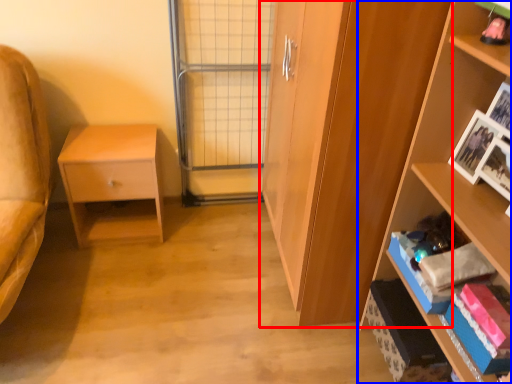
Question: Which object appears farthest to the camera in this image, cabinetry (highlighted by a red box) or shelf (highlighted by a blue box)?

Choices:
 (A) cabinetry
 (B) shelf

Answer: (A)